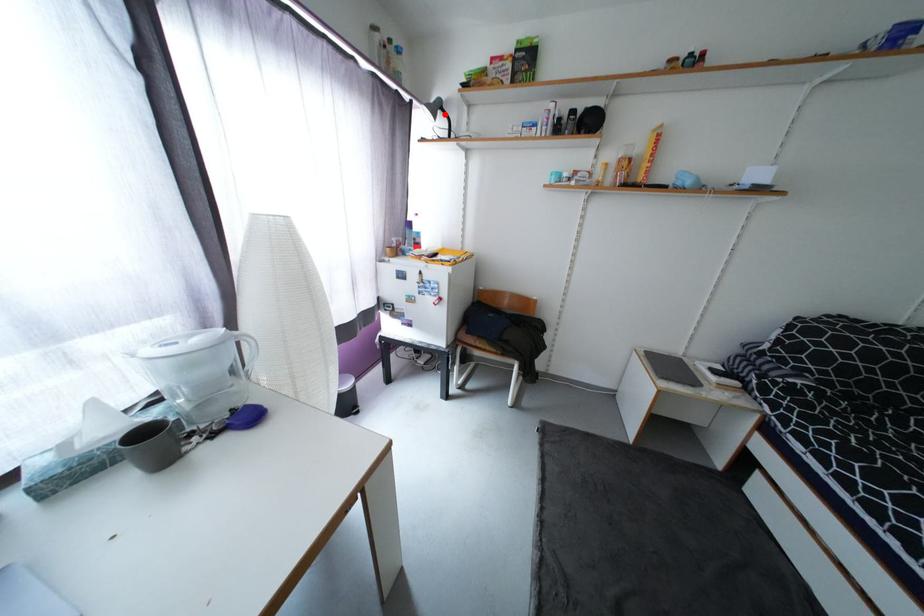
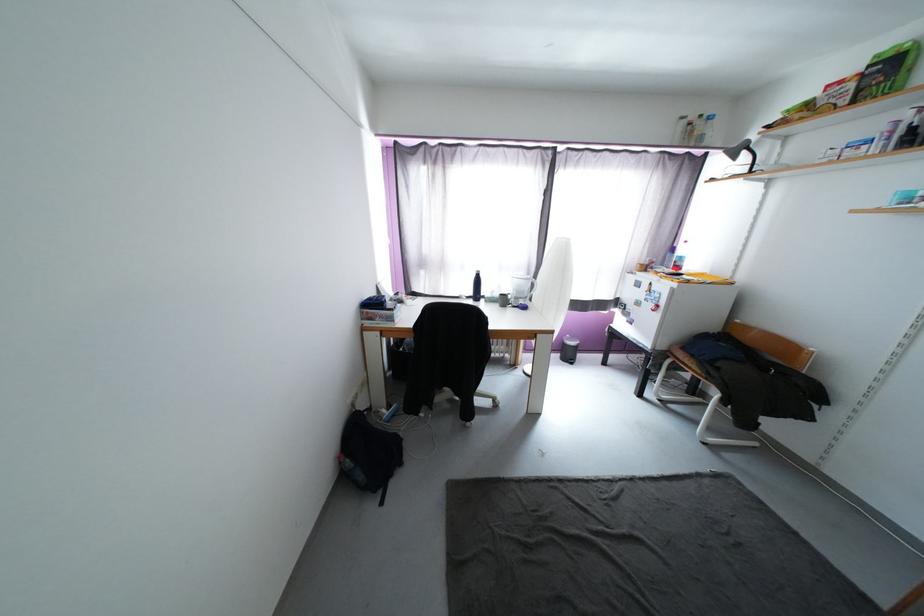
Question: I am providing you with two images of the same scene from different viewpoints. A red point is shown in image1. For the corresponding object point in image2, is it positioned nearer or farther from the camera?

Choices:
 (A) Nearer
 (B) Farther

Answer: (B)